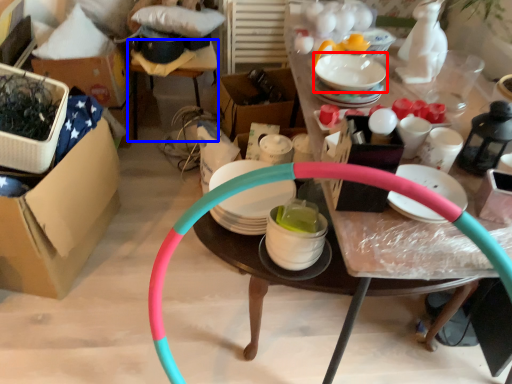
Question: Which point is closer to the camera, tableware (highlighted by a red box) or table (highlighted by a blue box)?

Choices:
 (A) tableware
 (B) table

Answer: (A)